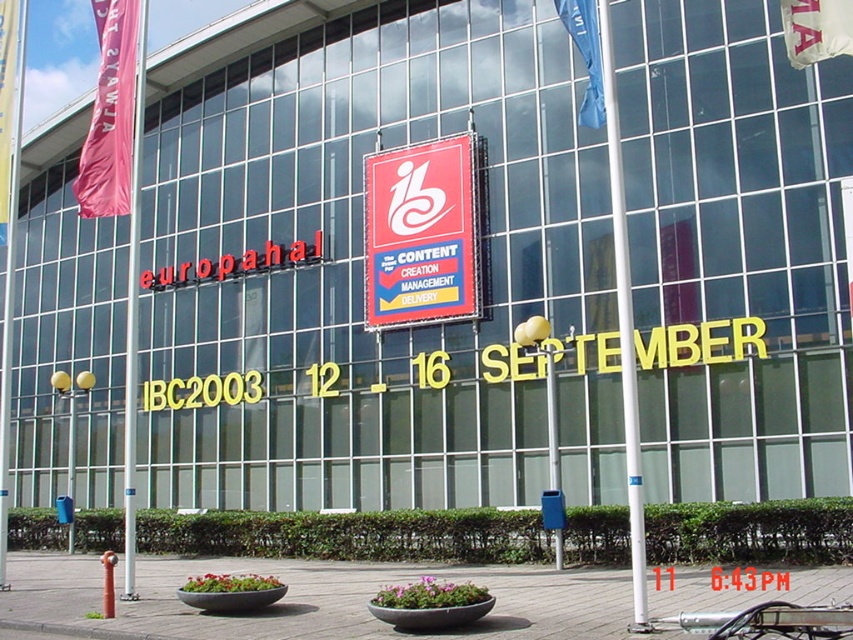
Question: Which point is farther to the camera?

Choices:
 (A) (114, 56)
 (B) (805, 44)
 (C) (407, 301)

Answer: (C)

Question: Is pink fabric banner at upper left bigger than blue fabric flag at upper right?

Choices:
 (A) no
 (B) yes

Answer: (B)

Question: Does red plastic sign at center have a smaller size compared to pink fabric flag at left?

Choices:
 (A) no
 (B) yes

Answer: (B)

Question: Considering the relative positions of pink fabric banner at upper left and pink fabric flag at left in the image provided, where is pink fabric banner at upper left located with respect to pink fabric flag at left?

Choices:
 (A) below
 (B) above

Answer: (B)

Question: Estimate the real-world distances between objects in this image. Which object is closer to the red plastic sign at center?

Choices:
 (A) pink fabric banner at upper left
 (B) white fabric banner at upper right
 (C) pink fabric flag at left

Answer: (C)

Question: Which point is closer to the camera?

Choices:
 (A) pink fabric flag at left
 (B) blue fabric flag at upper right
 (C) white fabric banner at upper right

Answer: (C)